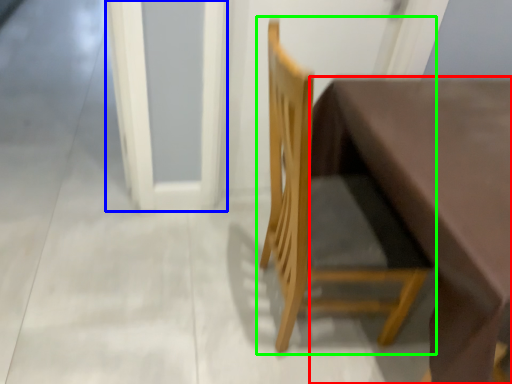
Question: Which object is positioned closest to table (highlighted by a red box)? Select from screen door (highlighted by a blue box) and chair (highlighted by a green box).

Choices:
 (A) screen door
 (B) chair

Answer: (B)